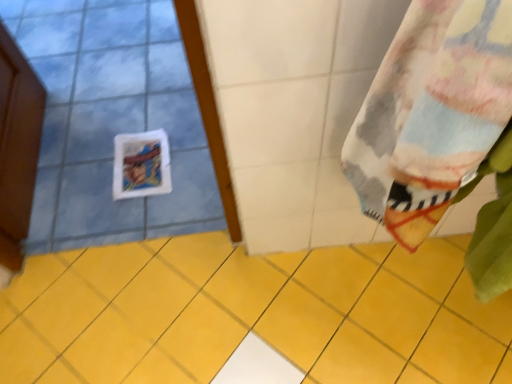
Question: From the image's perspective, is yellow ceramic tile at center above or below fluffy multicolored towel at right?

Choices:
 (A) above
 (B) below

Answer: (B)

Question: Is yellow ceramic tile at center situated inside fluffy multicolored towel at right or outside?

Choices:
 (A) inside
 (B) outside

Answer: (B)

Question: Relative to fluffy multicolored towel at right, is yellow ceramic tile at center in front or behind?

Choices:
 (A) behind
 (B) front

Answer: (A)

Question: Considering the positions of fluffy multicolored towel at right and yellow ceramic tile at center in the image, is fluffy multicolored towel at right taller or shorter than yellow ceramic tile at center?

Choices:
 (A) tall
 (B) short

Answer: (A)

Question: In terms of size, does fluffy multicolored towel at right appear bigger or smaller than yellow ceramic tile at center?

Choices:
 (A) small
 (B) big

Answer: (B)

Question: Is fluffy multicolored towel at right situated inside yellow ceramic tile at center or outside?

Choices:
 (A) inside
 (B) outside

Answer: (B)

Question: Considering the positions of point (369, 188) and point (212, 331), is point (369, 188) closer or farther from the camera than point (212, 331)?

Choices:
 (A) farther
 (B) closer

Answer: (B)